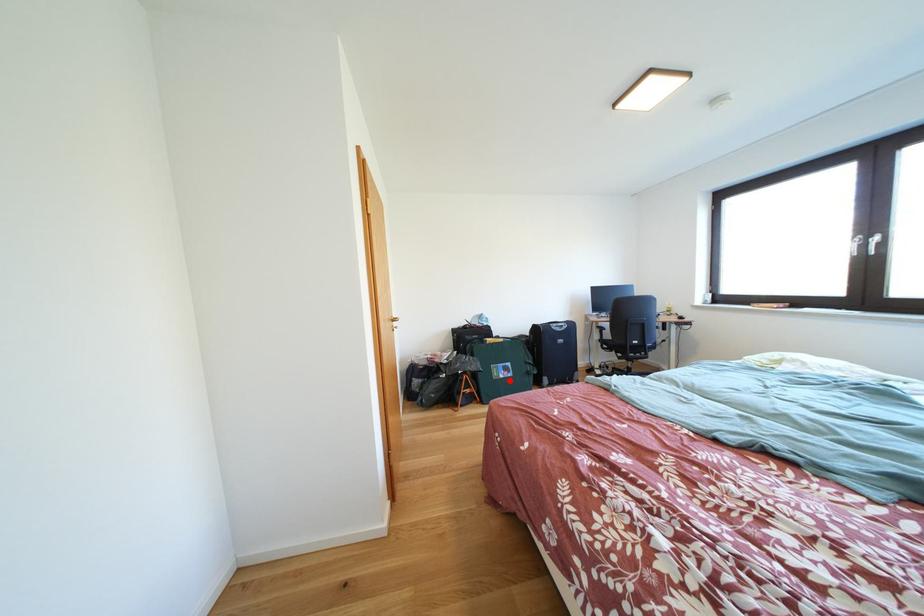
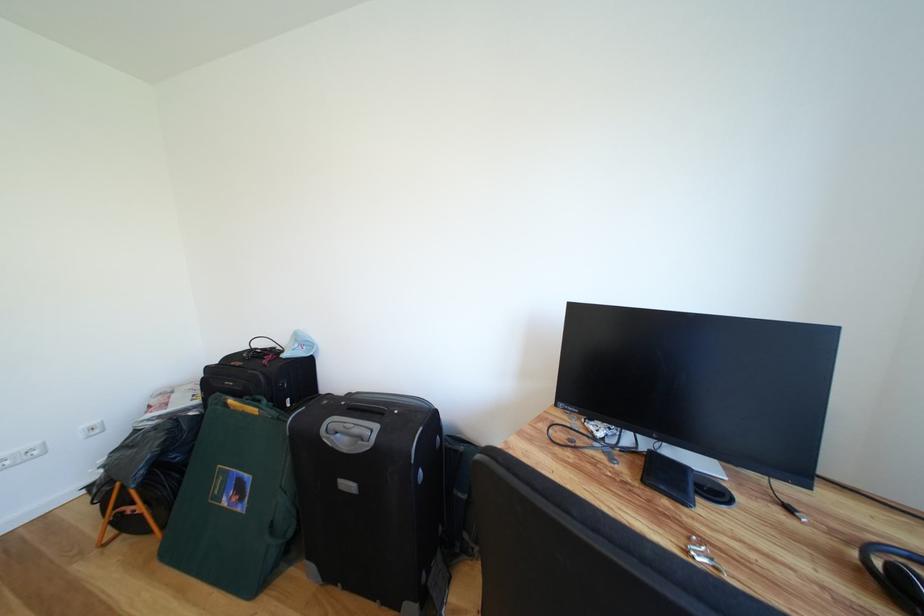
Question: I am providing you with two images of the same scene from different viewpoints. A red point is shown in image1. For the corresponding object point in image2, is it positioned nearer or farther from the camera?

Choices:
 (A) Nearer
 (B) Farther

Answer: (A)